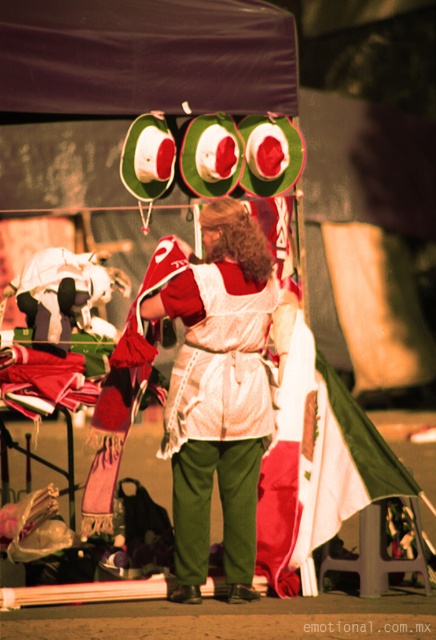
Question: Does black fabric canopy at upper center appear on the left side of white cotton apron at center?

Choices:
 (A) no
 (B) yes

Answer: (B)

Question: Can you confirm if black fabric canopy at upper center is positioned to the left of white cotton apron at center?

Choices:
 (A) yes
 (B) no

Answer: (A)

Question: Does black fabric canopy at upper center appear over white cotton apron at center?

Choices:
 (A) no
 (B) yes

Answer: (B)

Question: Which of the following is the farthest from the observer?

Choices:
 (A) (150, 100)
 (B) (221, 464)

Answer: (B)

Question: Which point is farther to the camera?

Choices:
 (A) 228,298
 (B) 98,29

Answer: (A)